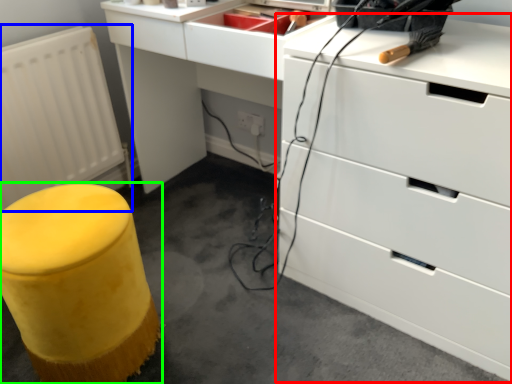
Question: Considering the real-world distances, which object is closest to chest of drawers (highlighted by a red box)? radiator (highlighted by a blue box) or furniture (highlighted by a green box).

Choices:
 (A) radiator
 (B) furniture

Answer: (B)